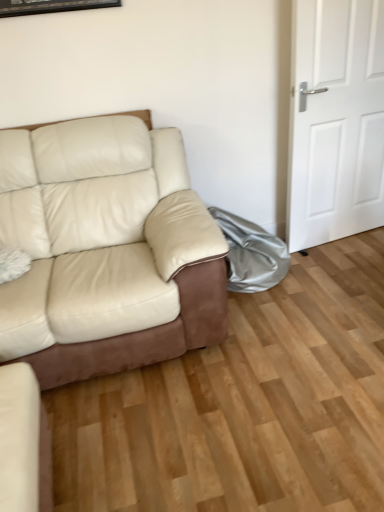
Question: From the image's perspective, is white matte door at right positioned above or below leather couch at lower left, positioned as the second studio couch in top-to-bottom order?

Choices:
 (A) above
 (B) below

Answer: (A)

Question: Visually, is white matte door at right positioned to the left or to the right of leather couch at lower left, positioned as the first studio couch in bottom-to-top order?

Choices:
 (A) left
 (B) right

Answer: (B)

Question: Which of these objects is positioned farthest from the silver metallic bag at lower right?

Choices:
 (A) white matte door at right
 (B) leather couch at lower left, positioned as the second studio couch in top-to-bottom order
 (C) beige leather couch at left, marked as the first studio couch in a top-to-bottom arrangement

Answer: (B)

Question: Which is nearer to the beige leather couch at left, marked as the first studio couch in a top-to-bottom arrangement?

Choices:
 (A) white matte door at right
 (B) leather couch at lower left, positioned as the first studio couch in bottom-to-top order
 (C) silver metallic bag at lower right

Answer: (C)